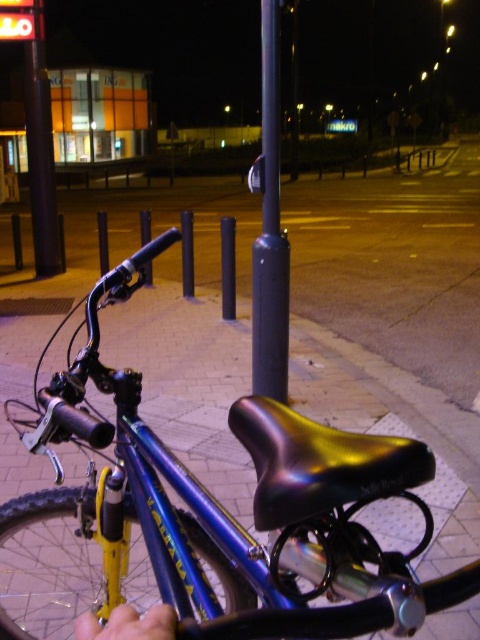
Is point (191, 499) more distant than point (52, 236)?

No, it is not.

The height and width of the screenshot is (640, 480). What do you see at coordinates (222, 509) in the screenshot?
I see `blue metallic bicycle at center` at bounding box center [222, 509].

Does point (254, 632) come closer to viewer compared to point (38, 186)?

Yes, point (254, 632) is in front of point (38, 186).

You are a GUI agent. You are given a task and a screenshot of the screen. Output one action in this format:
    pyautogui.click(x=<x>, y=<y>)
    Task: Click on the blue metallic bicycle at center
    The image size is (480, 640).
    Given the screenshot: What is the action you would take?
    pyautogui.click(x=222, y=509)

Looking at this image, can you confirm if blue metallic bicycle at center is positioned below black matte pole at center?

Yes.

What do you see at coordinates (222, 509) in the screenshot? Image resolution: width=480 pixels, height=640 pixels. I see `blue metallic bicycle at center` at bounding box center [222, 509].

The image size is (480, 640). Identify the location of blue metallic bicycle at center. (222, 509).

Is the position of black matte pole at center less distant than that of smooth black pole at upper left?

That is True.

This screenshot has height=640, width=480. Identify the location of black matte pole at center. (269, 232).